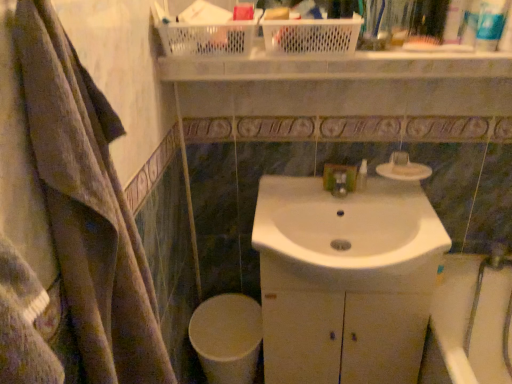
Question: Is white glossy toilet bowl at lower center taller than white matte soap at upper center?

Choices:
 (A) no
 (B) yes

Answer: (B)

Question: Could you tell me if white glossy toilet bowl at lower center is facing white matte soap at upper center?

Choices:
 (A) no
 (B) yes

Answer: (A)

Question: Does white glossy toilet bowl at lower center appear on the right side of white matte soap at upper center?

Choices:
 (A) no
 (B) yes

Answer: (A)

Question: Is white glossy toilet bowl at lower center in front of white matte soap at upper center?

Choices:
 (A) yes
 (B) no

Answer: (B)

Question: Can you confirm if white glossy toilet bowl at lower center is shorter than white matte soap at upper center?

Choices:
 (A) no
 (B) yes

Answer: (A)

Question: In the image, is white glossy cabinet at center positioned in front of or behind white plastic toothpaste tube at upper right, the second toiletry from the bottom?

Choices:
 (A) behind
 (B) front

Answer: (A)

Question: Looking at the image, does white glossy cabinet at center seem bigger or smaller compared to white plastic toothpaste tube at upper right, the second toiletry from the bottom?

Choices:
 (A) big
 (B) small

Answer: (A)

Question: Choose the correct answer: Is white glossy cabinet at center inside white plastic toothpaste tube at upper right, which ranks as the 3th toiletry in top-to-bottom order, or outside it?

Choices:
 (A) inside
 (B) outside

Answer: (B)

Question: From the image's perspective, relative to white plastic toothpaste tube at upper right, which is the 3th toiletry from back to front, is white glossy cabinet at center above or below?

Choices:
 (A) above
 (B) below

Answer: (B)

Question: In terms of width, does green matte soap dispenser at center, which is the first toiletry from bottom to top, look wider or thinner when compared to white glossy cabinet at center?

Choices:
 (A) wide
 (B) thin

Answer: (B)

Question: Based on their sizes in the image, would you say green matte soap dispenser at center, which is the fourth toiletry from top to bottom, is bigger or smaller than white glossy cabinet at center?

Choices:
 (A) small
 (B) big

Answer: (A)

Question: Is point (361, 165) closer or farther from the camera than point (413, 301)?

Choices:
 (A) closer
 (B) farther

Answer: (B)

Question: From a real-world perspective, is green matte soap dispenser at center, the 1th toiletry viewed from the back, physically located above or below white glossy cabinet at center?

Choices:
 (A) below
 (B) above

Answer: (B)

Question: Looking at the image, does white matte soap at upper center seem bigger or smaller compared to white glossy sink at center?

Choices:
 (A) small
 (B) big

Answer: (A)

Question: Considering the positions of point (413, 165) and point (260, 243), is point (413, 165) closer or farther from the camera than point (260, 243)?

Choices:
 (A) closer
 (B) farther

Answer: (B)